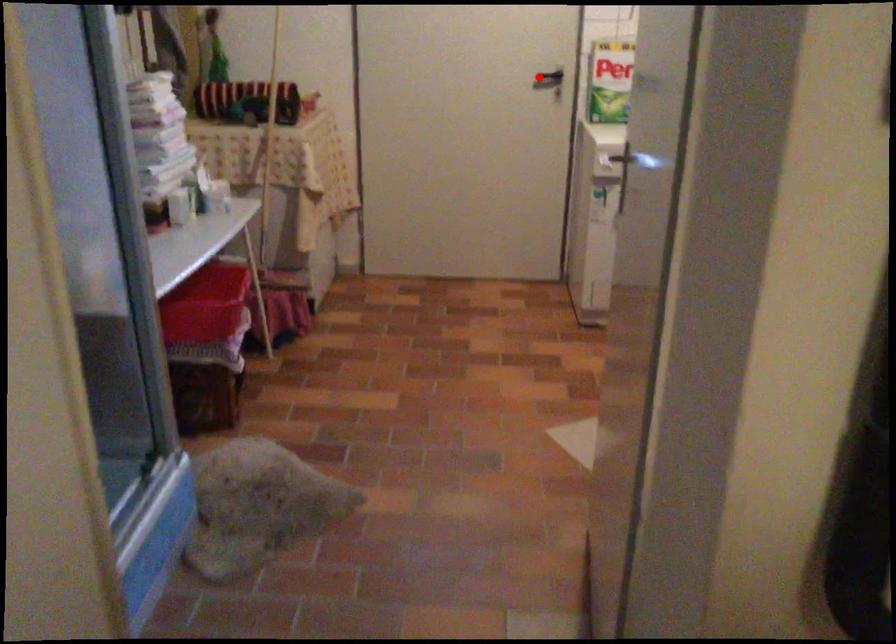
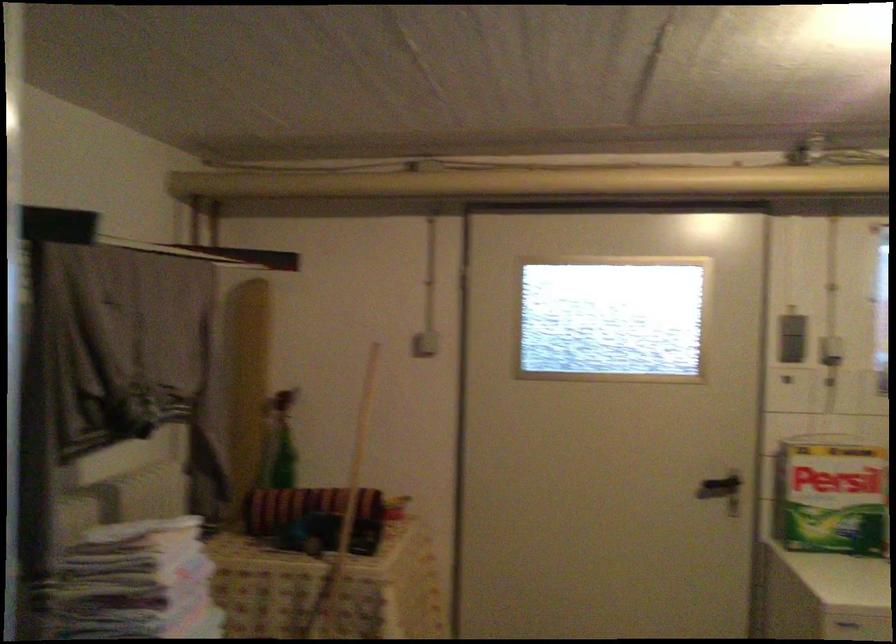
Question: I am providing you with two images of the same scene from different viewpoints. A red point is marked on the first image. At the location where the point appears in image 1, is it still visible in image 2?

Choices:
 (A) Yes
 (B) No

Answer: (A)